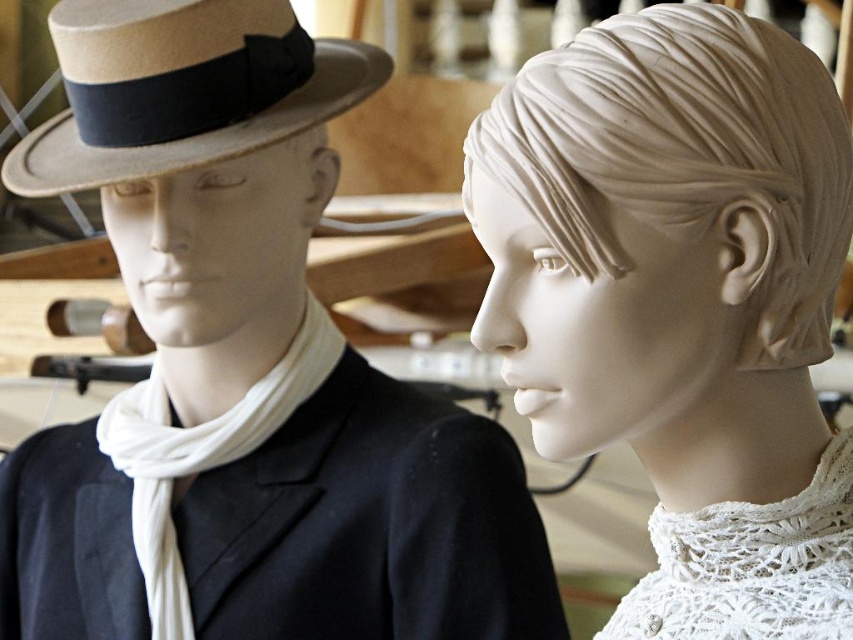
Does beige felt fedora at left have a smaller size compared to white cotton scarf at left?

Actually, beige felt fedora at left might be larger than white cotton scarf at left.

Is the position of beige felt fedora at left less distant than that of white cotton scarf at left?

Yes.

What do you see at coordinates (183, 88) in the screenshot? Image resolution: width=853 pixels, height=640 pixels. I see `beige felt fedora at left` at bounding box center [183, 88].

The image size is (853, 640). I want to click on beige felt fedora at left, so click(183, 88).

Who is higher up, matte black hat at left or white marble head at center?

white marble head at center

Is point (270, 548) closer to camera compared to point (795, 140)?

No, it is behind (795, 140).

At what (x,y) coordinates should I click in order to perform the action: click on matte black hat at left. Please return your answer as a coordinate pair (x, y). The width and height of the screenshot is (853, 640). Looking at the image, I should click on (247, 369).

You are a GUI agent. You are given a task and a screenshot of the screen. Output one action in this format:
    pyautogui.click(x=<x>, y=<y>)
    Task: Click on the matte black hat at left
    
    Given the screenshot: What is the action you would take?
    pyautogui.click(x=247, y=369)

At what (x,y) coordinates should I click in order to perform the action: click on matte black hat at left. Please return your answer as a coordinate pair (x, y). Looking at the image, I should click on (247, 369).

Does point (212, 540) come farther from viewer compared to point (165, 468)?

No.

Identify the location of matte black hat at left. This screenshot has height=640, width=853. (247, 369).